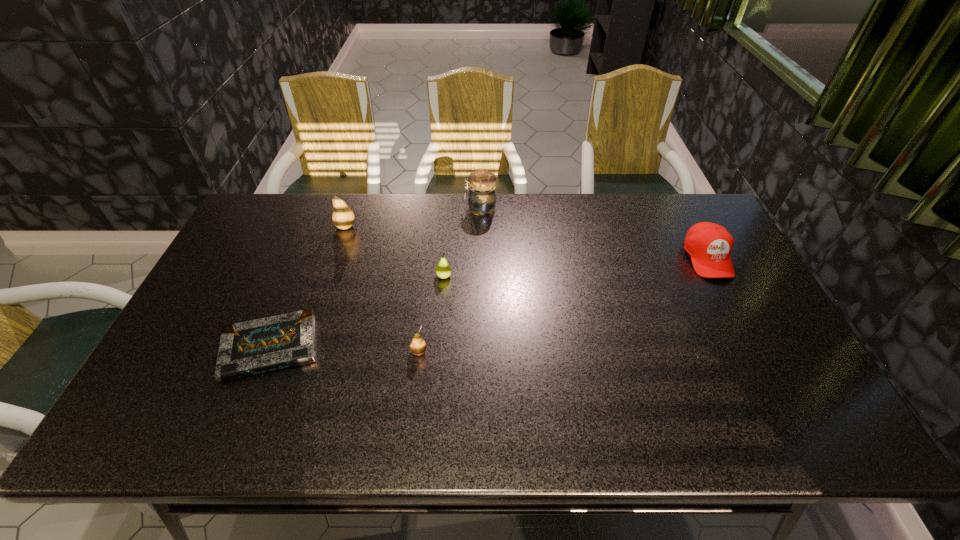
This screenshot has width=960, height=540. Identify the location of vacant space that's between the farthest pear and the second pear from left to right. (382, 289).

The height and width of the screenshot is (540, 960). I want to click on free space between the third object from right to left and the notebook, so click(357, 312).

In order to click on free spot between the fourth object from right to left and the second object from right to left in this screenshot , I will do `click(449, 280)`.

I want to click on free space between the rightmost object and the tallest pear, so click(x=526, y=242).

The width and height of the screenshot is (960, 540). Identify the location of unoccupied area between the baseball cap and the tallest pear. (526, 242).

You are a GUI agent. You are given a task and a screenshot of the screen. Output one action in this format:
    pyautogui.click(x=<x>, y=<y>)
    Task: Click on the free space between the shortest object and the second farthest pear
    
    Given the screenshot: What is the action you would take?
    pyautogui.click(x=357, y=312)

This screenshot has width=960, height=540. I want to click on vacant region between the baseball cap and the fourth object from left to right, so click(x=575, y=267).

The height and width of the screenshot is (540, 960). Identify the location of vacant space that is in between the notebook and the jar. (375, 278).

Locate an element on the screen. vacant region between the nearest pear and the rightmost object is located at coordinates (563, 305).

Locate which object ranks third in proximity to the tallest pear. Please provide its 2D coordinates. Your answer should be formatted as a tuple, i.e. [(x, y)], where the tuple contains the x and y coordinates of a point satisfying the conditions above.

[(481, 196)]